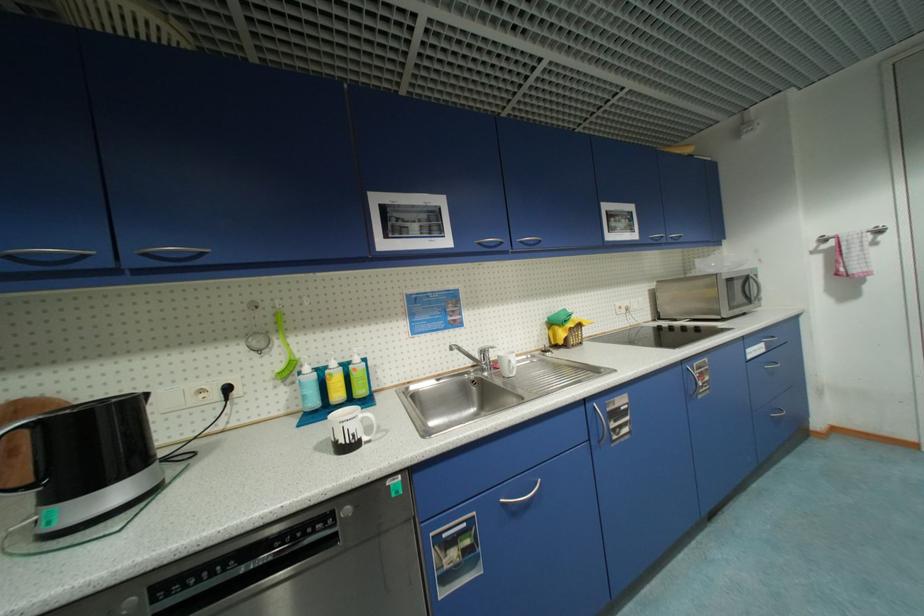
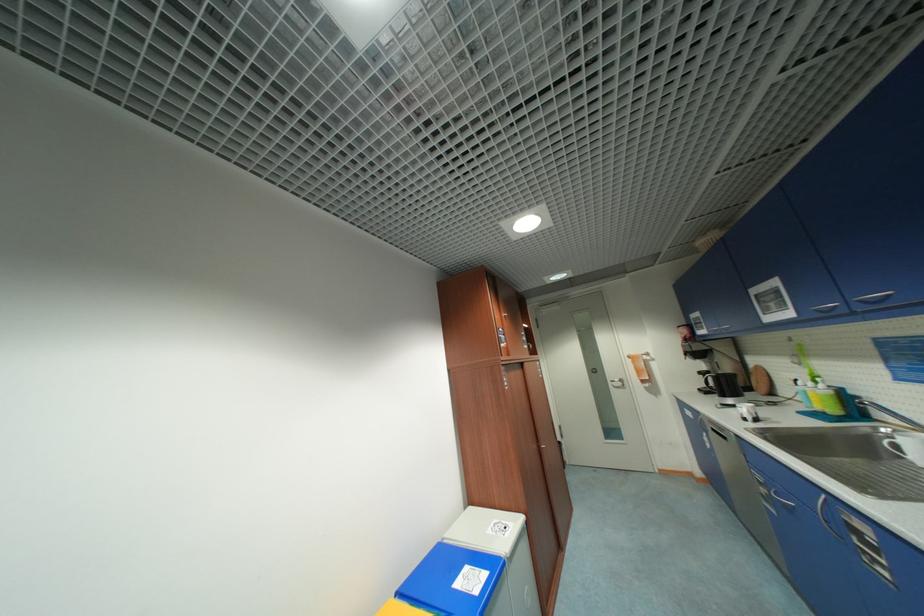
In the second image, find the point that corresponds to point 459,554 in the first image.

(768, 491)